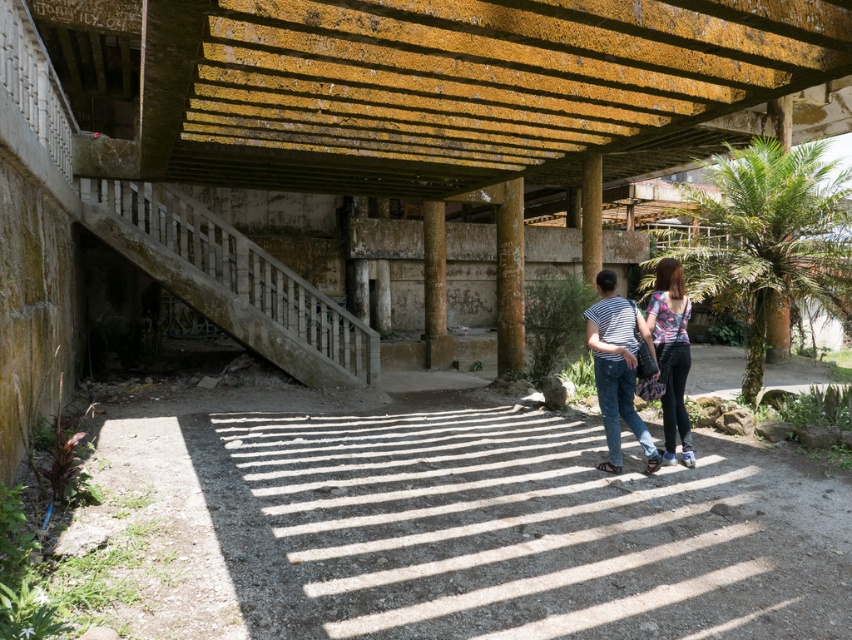
Does concrete/stained stairs at lower left come in front of floral fabric top at center?

No.

Who is more forward, (258, 288) or (672, 451)?

Point (672, 451) is more forward.

Which is behind, point (281, 356) or point (666, 401)?

The point (281, 356) is more distant.

Locate an element on the screen. concrete/stained stairs at lower left is located at coordinates (231, 282).

Does striped cotton shirt at center have a lesser height compared to floral fabric top at center?

Yes, striped cotton shirt at center is shorter than floral fabric top at center.

Who is lower down, striped cotton shirt at center or floral fabric top at center?

Positioned lower is striped cotton shirt at center.

You are a GUI agent. You are given a task and a screenshot of the screen. Output one action in this format:
    pyautogui.click(x=<x>, y=<y>)
    Task: Click on the striped cotton shirt at center
    The height and width of the screenshot is (640, 852).
    Given the screenshot: What is the action you would take?
    pyautogui.click(x=617, y=368)

Which is more to the left, gray gravel path at center or floral fabric top at center?

Positioned to the left is gray gravel path at center.

Does point (676, 518) lie in front of point (665, 264)?

Yes, point (676, 518) is in front of point (665, 264).

Does point (809, 481) come farther from viewer compared to point (666, 328)?

No.

You are a GUI agent. You are given a task and a screenshot of the screen. Output one action in this format:
    pyautogui.click(x=<x>, y=<y>)
    Task: Click on the gray gravel path at center
    
    Given the screenshot: What is the action you would take?
    pyautogui.click(x=475, y=529)